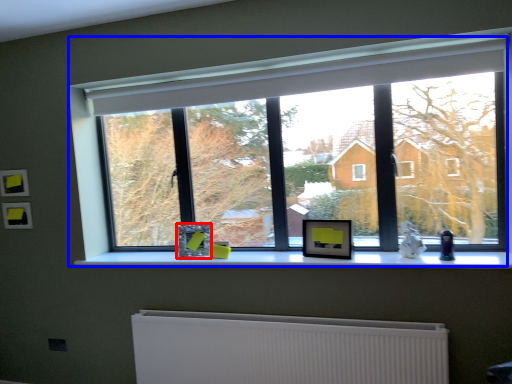
Question: Among these objects, which one is farthest to the camera, picture frame (highlighted by a red box) or window (highlighted by a blue box)?

Choices:
 (A) picture frame
 (B) window

Answer: (A)